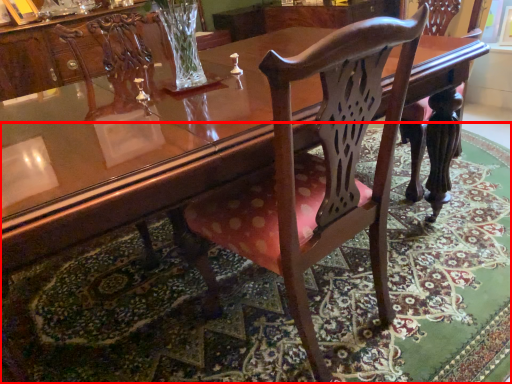
Question: In this image, where is mat (annotated by the red box) located relative to chair?

Choices:
 (A) left
 (B) right

Answer: (B)